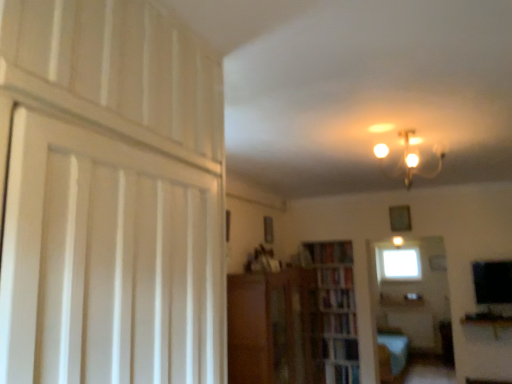
Question: From the image's perspective, is wooden bookcase at center positioned above or below hardcover book at center, placed as the 1th book when sorted from top to bottom?

Choices:
 (A) above
 (B) below

Answer: (B)

Question: Considering the positions of wooden bookcase at center and hardcover book at center, positioned as the 4th book in bottom-to-top order, in the image, is wooden bookcase at center taller or shorter than hardcover book at center, positioned as the 4th book in bottom-to-top order,?

Choices:
 (A) tall
 (B) short

Answer: (A)

Question: Which is nearer to the white wood door at left?

Choices:
 (A) hardcover book at center, the third book when ordered from bottom to top
 (B) transparent glass window at center
 (C) matte glass chandelier at upper center
 (D) wooden cabinet at center
 (E) hardcover book at center, acting as the 3th book starting from the top

Answer: (C)

Question: Estimate the real-world distances between objects in this image. Which object is closer to the wooden bookcase at center?

Choices:
 (A) wooden bookshelf at center, placed as the 4th book when sorted from top to bottom
 (B) hardcover book at center, the third book when ordered from bottom to top
 (C) hardcover book at center, acting as the 3th book starting from the top
 (D) hardcover book at center, positioned as the 4th book in bottom-to-top order
 (E) matte glass chandelier at upper center

Answer: (C)